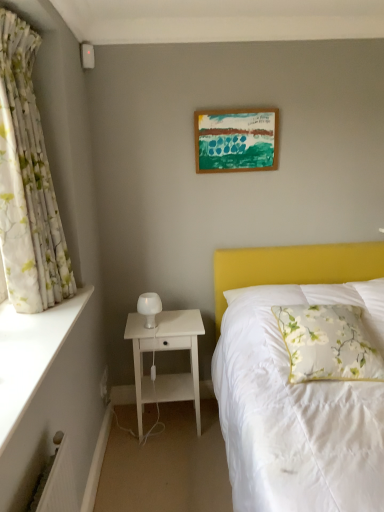
Question: Is white frosted glass table lamp at left located outside white smooth ledge at left?

Choices:
 (A) no
 (B) yes

Answer: (B)

Question: From a real-world perspective, is white frosted glass table lamp at left beneath white smooth ledge at left?

Choices:
 (A) no
 (B) yes

Answer: (B)

Question: Is white frosted glass table lamp at left at the left side of white smooth ledge at left?

Choices:
 (A) no
 (B) yes

Answer: (A)

Question: Is white frosted glass table lamp at left aimed at white smooth ledge at left?

Choices:
 (A) no
 (B) yes

Answer: (A)

Question: Is white smooth ledge at left inside white frosted glass table lamp at left?

Choices:
 (A) no
 (B) yes

Answer: (A)

Question: Is white frosted glass table lamp at left thinner than white smooth ledge at left?

Choices:
 (A) no
 (B) yes

Answer: (B)

Question: From the image's perspective, would you say wooden picture frame at upper center is shown under floral fabric pillow at right?

Choices:
 (A) yes
 (B) no

Answer: (B)

Question: From the image's perspective, would you say wooden picture frame at upper center is positioned over floral fabric pillow at right?

Choices:
 (A) no
 (B) yes

Answer: (B)

Question: Considering the relative sizes of wooden picture frame at upper center and floral fabric pillow at right in the image provided, is wooden picture frame at upper center wider than floral fabric pillow at right?

Choices:
 (A) yes
 (B) no

Answer: (B)

Question: Could floral fabric pillow at right be considered to be inside wooden picture frame at upper center?

Choices:
 (A) yes
 (B) no

Answer: (B)

Question: Is wooden picture frame at upper center to the right of floral fabric pillow at right from the viewer's perspective?

Choices:
 (A) yes
 (B) no

Answer: (B)

Question: Is wooden picture frame at upper center looking in the opposite direction of floral fabric pillow at right?

Choices:
 (A) no
 (B) yes

Answer: (A)

Question: Are white wood nightstand at lower left and floral fabric pillow at right far apart?

Choices:
 (A) no
 (B) yes

Answer: (A)